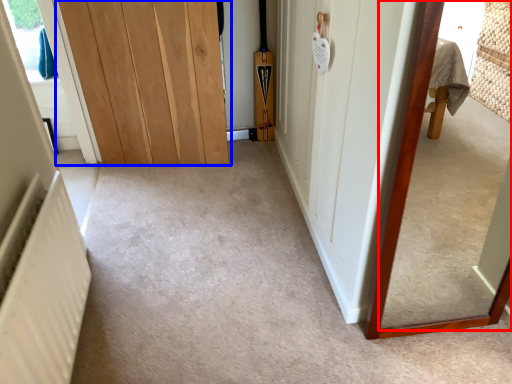
Question: Which point is further to the camera, mirror (highlighted by a red box) or door (highlighted by a blue box)?

Choices:
 (A) mirror
 (B) door

Answer: (B)